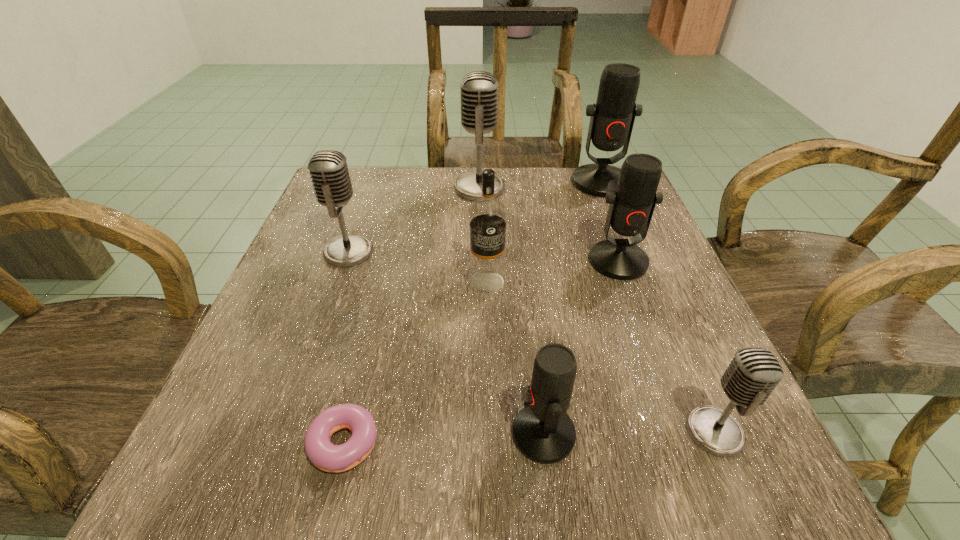
Where is `gray microphone that is the closest to the shortest object`? Image resolution: width=960 pixels, height=540 pixels. gray microphone that is the closest to the shortest object is located at coordinates (328, 169).

At what (x,y) coordinates should I click in order to perform the action: click on red microphone that stands as the second closest to the leftmost microphone. Please return your answer as a coordinate pair (x, y). The width and height of the screenshot is (960, 540). Looking at the image, I should click on (631, 207).

This screenshot has width=960, height=540. Identify the location of the second closest red microphone to the farthest red microphone. (542, 431).

This screenshot has width=960, height=540. In order to click on vacant space that satisfies the following two spatial constraints: 1. on the side of the second nearest red microphone with the red ring; 2. on the side of the nearest red microphone with the red ring in this screenshot , I will do `click(681, 434)`.

Locate an element on the screen. This screenshot has height=540, width=960. free space that satisfies the following two spatial constraints: 1. on the back side of the second gray microphone from left to right; 2. on the left side of the purple doughnut is located at coordinates [402, 188].

Image resolution: width=960 pixels, height=540 pixels. Find the location of `free location that satisfies the following two spatial constraints: 1. on the side of the nearest gray microphone with the red ring; 2. on the left side of the biggest red microphone`. free location that satisfies the following two spatial constraints: 1. on the side of the nearest gray microphone with the red ring; 2. on the left side of the biggest red microphone is located at coordinates (699, 431).